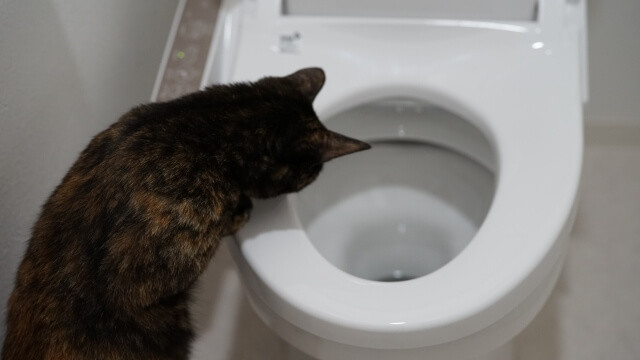
This screenshot has height=360, width=640. What are the coordinates of `wall` in the screenshot? It's located at (61, 103).